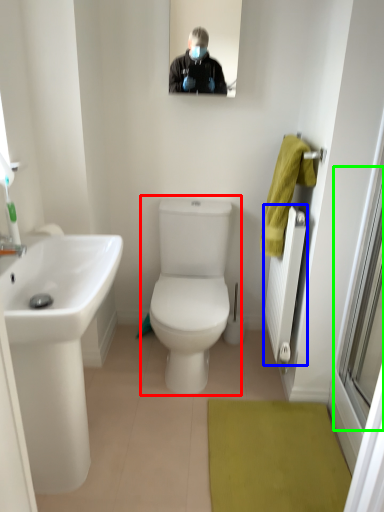
Question: Which object is the farthest from toilet (highlighted by a red box)? Choose among these: radiator (highlighted by a blue box) or window screen (highlighted by a green box).

Choices:
 (A) radiator
 (B) window screen

Answer: (B)